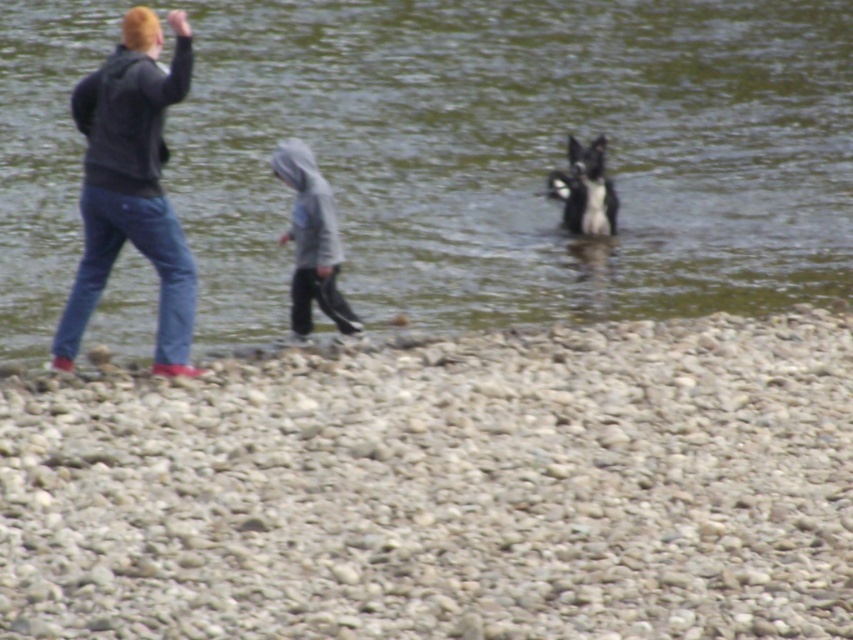
Between matte black hoodie at left and gray fleece hoodie at center, which one has more height?

matte black hoodie at left is taller.

Between matte black hoodie at left and gray fleece hoodie at center, which one has less height?

With less height is gray fleece hoodie at center.

This screenshot has height=640, width=853. Describe the element at coordinates (131, 184) in the screenshot. I see `matte black hoodie at left` at that location.

Identify the location of matte black hoodie at left. (131, 184).

Which is behind, point (379, 81) or point (312, 257)?

Point (379, 81)

Between point (585, 58) and point (328, 211), which one is positioned behind?

Positioned behind is point (585, 58).

The image size is (853, 640). Identify the location of greenish water at center. (518, 156).

Between point (637, 362) and point (129, 312), which one is positioned in front?

Point (637, 362) is in front.

Between point (267, 449) and point (318, 13), which one is positioned behind?

The point (318, 13) is more distant.

Which is in front, point (750, 605) or point (68, 17)?

Positioned in front is point (750, 605).

At what (x,y) coordinates should I click in order to perform the action: click on smooth pebble at lower center. Please return your answer as a coordinate pair (x, y). This screenshot has width=853, height=640. Looking at the image, I should click on [x=444, y=488].